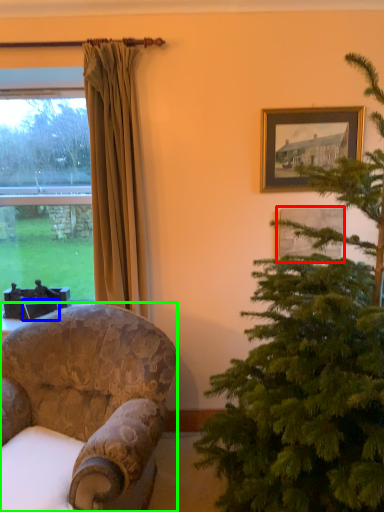
Question: Estimate the real-world distances between objects in this image. Which object is closer to picture frame (highlighted by a red box), picture frame (highlighted by a blue box) or chair (highlighted by a green box)?

Choices:
 (A) picture frame
 (B) chair

Answer: (B)